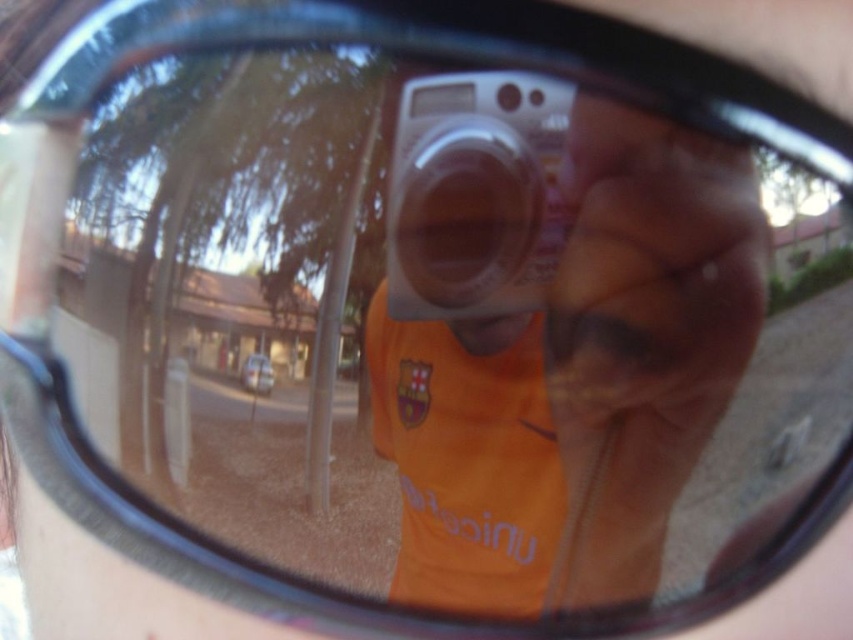
You are a photographer adjusting your camera settings. You notice two points in the reflection through your sunglasses lens at coordinates point (x=602, y=260) and point (x=463, y=260). Which point is nearer to your camera lens?

Point (x=602, y=260) is closer to the camera than point (x=463, y=260).